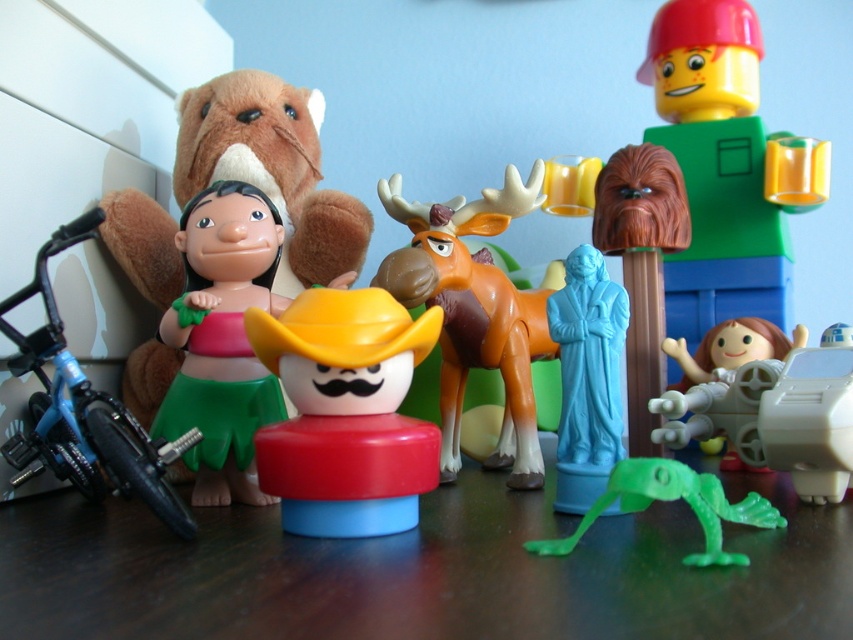
You are a child trying to reach the blue metallic bicycle at left from your current position in front of the matte plastic cowboy at center. Can you easily grab it without moving the cowboy?

The blue metallic bicycle at left is behind the matte plastic cowboy at center, so you can easily reach it by moving around the cowboy to access the bicycle from behind.

You are a child playing with the toys on the dark wooden surface. You want to pick up the green plastic figure at right and the orange rubber moose at center. Which one can you grab first without moving your hand from its current position?

You can grab the green plastic figure at right first because it is closer to you than the orange rubber moose at center, so it is within reach without moving your hand.